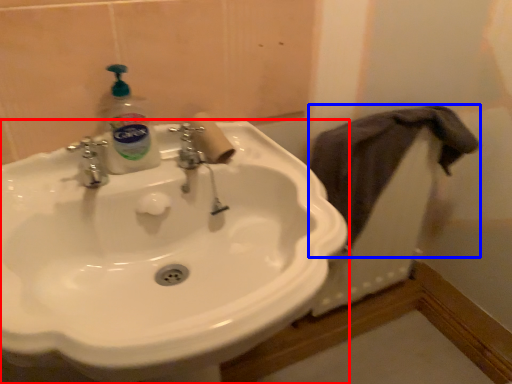
Question: Which object appears closest to the camera in this image, sink (highlighted by a red box) or bath towel (highlighted by a blue box)?

Choices:
 (A) sink
 (B) bath towel

Answer: (A)